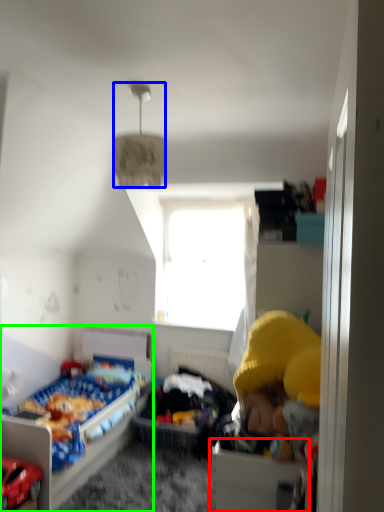
Question: Which object is the closest to the drawer (highlighted by a red box)? Choose among these: lamp (highlighted by a blue box) or bed (highlighted by a green box).

Choices:
 (A) lamp
 (B) bed

Answer: (A)